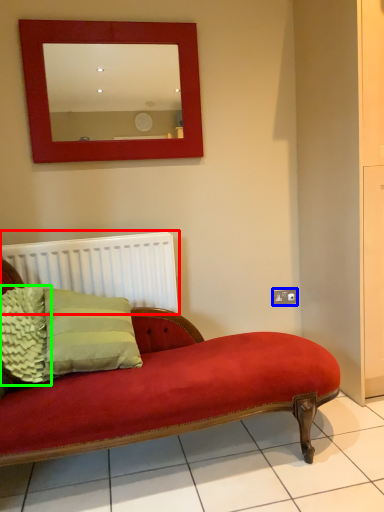
Question: Which object is positioned farthest from radiator (highlighted by a red box)? Select from electric outlet (highlighted by a blue box) and pillow (highlighted by a green box).

Choices:
 (A) electric outlet
 (B) pillow

Answer: (A)